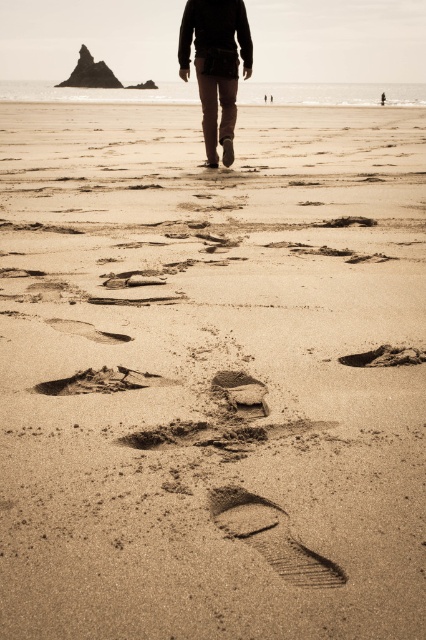
Question: Does matte brown pants at center have a smaller size compared to dark brown sand at center?

Choices:
 (A) no
 (B) yes

Answer: (A)

Question: Which object is closer to the camera taking this photo?

Choices:
 (A) matte brown pants at center
 (B) dark brown sand at center

Answer: (B)

Question: Is dark brown textured sand at center to the left of dark brown sand at center from the viewer's perspective?

Choices:
 (A) yes
 (B) no

Answer: (A)

Question: Does matte brown pants at center have a lesser width compared to dark brown textured sand at center?

Choices:
 (A) no
 (B) yes

Answer: (A)

Question: Which of these objects is positioned farthest from the dark brown sand at center?

Choices:
 (A) dark brown textured sand at center
 (B) matte brown pants at center

Answer: (B)

Question: Among these points, which one is nearest to the camera?

Choices:
 (A) (273, 538)
 (B) (416, 352)
 (C) (230, 67)

Answer: (A)